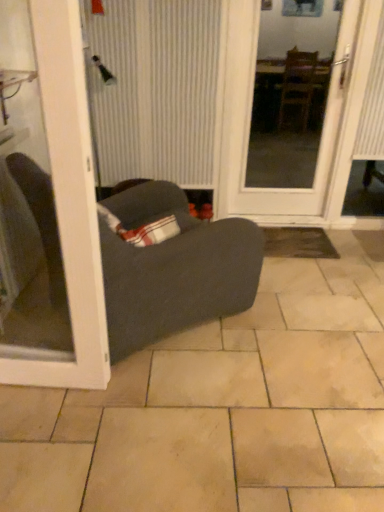
Measure the distance between point [262,56] and camera.

5.19 meters.

The image size is (384, 512). Identify the location of white glossy door at left, which is counted as the second door, starting from the back. (69, 201).

You are a GUI agent. You are given a task and a screenshot of the screen. Output one action in this format:
    pyautogui.click(x=<x>, y=<y>)
    Task: Click on the dark gray fabric studio couch at center
    Image resolution: width=384 pixels, height=512 pixels.
    Given the screenshot: What is the action you would take?
    pyautogui.click(x=174, y=270)

From the image's perspective, is white glossy door at center, which appears as the first door when viewed from the right, positioned above or below white striped curtain at center?

Based on their image positions, white glossy door at center, which appears as the first door when viewed from the right, is located above white striped curtain at center.

How far apart are white glossy door at center, the 1th door when ordered from back to front, and white striped curtain at center?

white glossy door at center, the 1th door when ordered from back to front, is 5.87 feet away from white striped curtain at center.

In order to click on curtain below the white glossy door at center, which appears as the first door when viewed from the right (from the image's perspective) in this screenshot , I will do `click(155, 89)`.

Is white glossy door at center, which appears as the first door when viewed from the right, further to camera compared to white striped curtain at center?

No, white glossy door at center, which appears as the first door when viewed from the right, is in front of white striped curtain at center.

Is white glossy door at left, arranged as the 1th door when viewed from the left, far away from dark gray fabric studio couch at center?

That's not correct — white glossy door at left, arranged as the 1th door when viewed from the left, is a little close to dark gray fabric studio couch at center.

Who is more distant, white glossy door at left, acting as the 1th door starting from the front, or dark gray fabric studio couch at center?

dark gray fabric studio couch at center.

From the picture: Is white glossy door at left, arranged as the 1th door when viewed from the left, turned away from dark gray fabric studio couch at center?

Yes.

Does beige ceramic tile at center contain dark gray fabric studio couch at center?

That's incorrect, dark gray fabric studio couch at center is not inside beige ceramic tile at center.

Is beige ceramic tile at center to the right of dark gray fabric studio couch at center from the viewer's perspective?

Correct, you'll find beige ceramic tile at center to the right of dark gray fabric studio couch at center.

Considering the sizes of beige ceramic tile at center and dark gray fabric studio couch at center in the image, is beige ceramic tile at center taller or shorter than dark gray fabric studio couch at center?

beige ceramic tile at center is shorter than dark gray fabric studio couch at center.

Is the surface of white glossy door at left, placed as the second door when sorted from right to left, in direct contact with white glossy door at center, which appears as the first door when viewed from the right?

No.

From the image's perspective, is white glossy door at left, arranged as the 1th door when viewed from the left, below white glossy door at center, which is the 2th door in front-to-back order?

Yes, from the image's perspective, white glossy door at left, arranged as the 1th door when viewed from the left, is below white glossy door at center, which is the 2th door in front-to-back order.

Which is more to the right, white glossy door at left, placed as the second door when sorted from right to left, or white glossy door at center, the 1th door when ordered from back to front?

Positioned to the right is white glossy door at center, the 1th door when ordered from back to front.

Is white glossy door at left, placed as the second door when sorted from right to left, surrounding white glossy door at center, the 1th door when ordered from back to front?

No, white glossy door at left, placed as the second door when sorted from right to left, does not contain white glossy door at center, the 1th door when ordered from back to front.

Which is farther, (110, 257) or (79, 439)?

The point (110, 257) is more distant.

Based on the photo, can we say dark gray fabric studio couch at center lies outside beige ceramic tile at center?

Indeed, dark gray fabric studio couch at center is completely outside beige ceramic tile at center.

In the scene shown: From a real-world perspective, which is physically below, dark gray fabric studio couch at center or beige ceramic tile at center?

In real-world perspective, beige ceramic tile at center is lower.

Which point is more forward, (207, 247) or (324, 33)?

The point (207, 247) is more forward.

Image resolution: width=384 pixels, height=512 pixels. I want to click on door behind the dark gray fabric studio couch at center, so click(x=284, y=103).

From the image's perspective, between dark gray fabric studio couch at center and white glossy door at center, which appears as the first door when viewed from the right, who is located below?

dark gray fabric studio couch at center, from the image's perspective.

Does dark gray fabric studio couch at center turn towards white glossy door at center, which appears as the first door when viewed from the right?

Yes, dark gray fabric studio couch at center is oriented towards white glossy door at center, which appears as the first door when viewed from the right.

Considering the sizes of white glossy door at left, acting as the 1th door starting from the front, and beige ceramic tile at center in the image, is white glossy door at left, acting as the 1th door starting from the front, taller or shorter than beige ceramic tile at center?

Clearly, white glossy door at left, acting as the 1th door starting from the front, is taller compared to beige ceramic tile at center.

In the scene shown: Who is more distant, white glossy door at left, acting as the 1th door starting from the front, or beige ceramic tile at center?

beige ceramic tile at center.

Which object is positioned more to the left, white glossy door at left, acting as the 1th door starting from the front, or beige ceramic tile at center?

white glossy door at left, acting as the 1th door starting from the front, is more to the left.

Where is `ceramic tile behind the white glossy door at left, which is counted as the second door, starting from the back`? ceramic tile behind the white glossy door at left, which is counted as the second door, starting from the back is located at coordinates (224, 407).

You are a GUI agent. You are given a task and a screenshot of the screen. Output one action in this format:
    pyautogui.click(x=<x>, y=<y>)
    Task: Click on the curtain that appears on the left of white glossy door at center, which is the 2th door in front-to-back order
    The image size is (384, 512).
    Given the screenshot: What is the action you would take?
    pyautogui.click(x=155, y=89)

The image size is (384, 512). I want to click on door that is below the dark gray fabric studio couch at center (from the image's perspective), so click(69, 201).

Considering their positions, is white glossy door at center, the second door positioned from the left, positioned closer to beige ceramic tile at center than dark gray fabric studio couch at center?

dark gray fabric studio couch at center lies closer to beige ceramic tile at center than the other object.

Based on their spatial positions, is white glossy door at left, which is counted as the second door, starting from the back, or dark gray fabric studio couch at center closer to white striped curtain at center?

Among the two, dark gray fabric studio couch at center is located nearer to white striped curtain at center.

Consider the image. From the image, which object appears to be farther from white striped curtain at center, white glossy door at center, which appears as the first door when viewed from the right, or dark gray fabric studio couch at center?

Among the two, white glossy door at center, which appears as the first door when viewed from the right, is located further to white striped curtain at center.

Which object lies further to the anchor point white glossy door at center, the second door positioned from the left, white glossy door at left, acting as the 1th door starting from the front, or dark gray fabric studio couch at center?

Among the two, white glossy door at left, acting as the 1th door starting from the front, is located further to white glossy door at center, the second door positioned from the left.

When comparing their distances from dark gray fabric studio couch at center, does beige ceramic tile at center or white glossy door at center, the 1th door when ordered from back to front, seem further?

white glossy door at center, the 1th door when ordered from back to front, is positioned further to the anchor dark gray fabric studio couch at center.

Which object lies further to the anchor point white glossy door at center, which is the 2th door in front-to-back order, beige ceramic tile at center or dark gray fabric studio couch at center?

beige ceramic tile at center is positioned further to the anchor white glossy door at center, which is the 2th door in front-to-back order.

When comparing their distances from dark gray fabric studio couch at center, does white striped curtain at center or white glossy door at center, the second door positioned from the left, seem closer?

Based on the image, white striped curtain at center appears to be nearer to dark gray fabric studio couch at center.

Considering their positions, is beige ceramic tile at center positioned closer to white glossy door at center, which is the 2th door in front-to-back order, than white glossy door at left, placed as the second door when sorted from right to left?

The object closer to white glossy door at center, which is the 2th door in front-to-back order, is beige ceramic tile at center.

Where is `studio couch between white glossy door at left, placed as the second door when sorted from right to left, and beige ceramic tile at center from left to right`? The width and height of the screenshot is (384, 512). studio couch between white glossy door at left, placed as the second door when sorted from right to left, and beige ceramic tile at center from left to right is located at coordinates (174, 270).

Locate an element on the screen. door between dark gray fabric studio couch at center and white striped curtain at center along the z-axis is located at coordinates (284, 103).

Find the location of `ceramic tile positioned between white glossy door at left, placed as the second door when sorted from right to left, and white striped curtain at center from near to far`. ceramic tile positioned between white glossy door at left, placed as the second door when sorted from right to left, and white striped curtain at center from near to far is located at coordinates (224, 407).

Locate an element on the screen. studio couch located between white glossy door at left, arranged as the 1th door when viewed from the left, and white striped curtain at center in the depth direction is located at coordinates (174, 270).